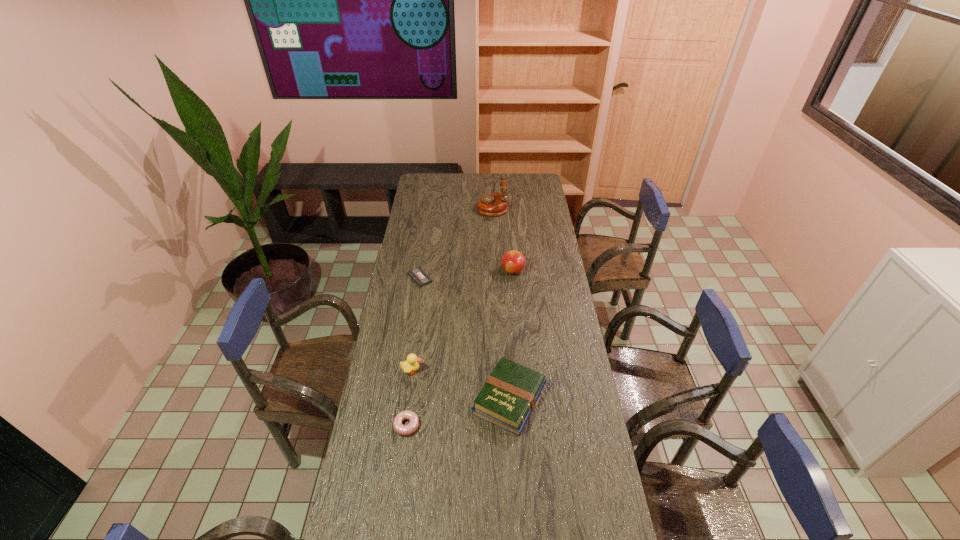
This screenshot has height=540, width=960. What are the coordinates of `the farthest object` in the screenshot? It's located at (495, 204).

Locate an element on the screen. Image resolution: width=960 pixels, height=540 pixels. telephone is located at coordinates (495, 204).

Identify the location of apple. (513, 262).

Locate an element on the screen. duckling is located at coordinates (409, 365).

Locate an element on the screen. book is located at coordinates click(509, 395).

Where is `the second shortest object`? The height and width of the screenshot is (540, 960). the second shortest object is located at coordinates (408, 429).

Find the location of `the shortest object`. the shortest object is located at coordinates (418, 275).

Where is `free space located 0.330m on the dial of the tallest object`? free space located 0.330m on the dial of the tallest object is located at coordinates (420, 206).

This screenshot has height=540, width=960. I want to click on free spot located 0.350m on the dial of the tallest object, so click(x=416, y=206).

At what (x,y) coordinates should I click in order to perform the action: click on free location located on the dial of the tallest object. Please return your answer as a coordinate pair (x, y). The width and height of the screenshot is (960, 540). Looking at the image, I should click on (439, 206).